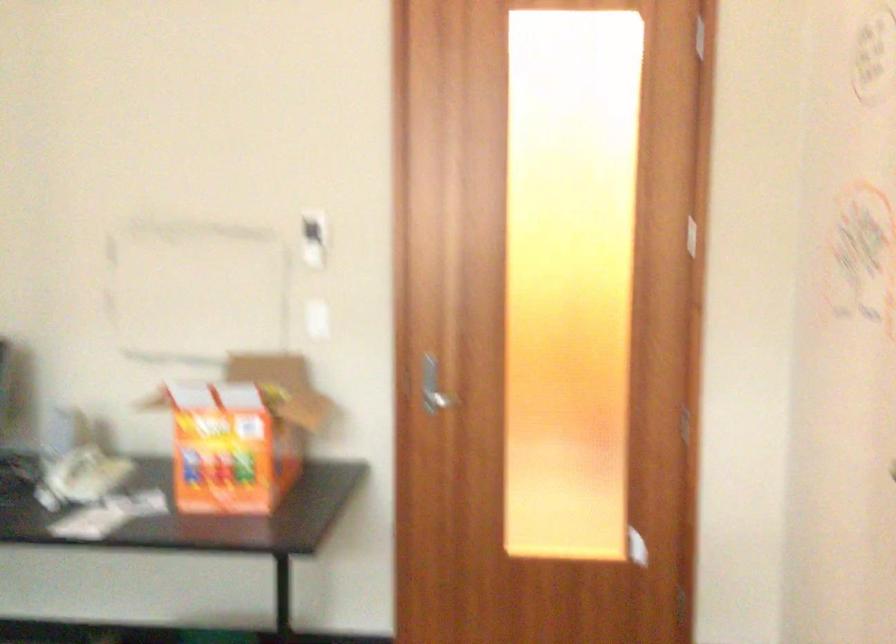
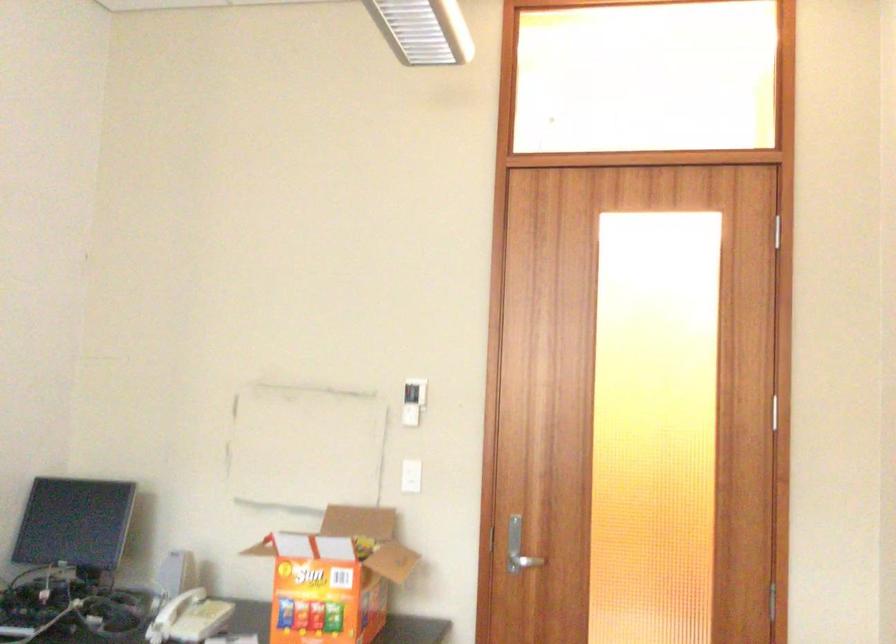
Find the pixel in the second image that matches point 312,238 in the first image.

(412, 401)